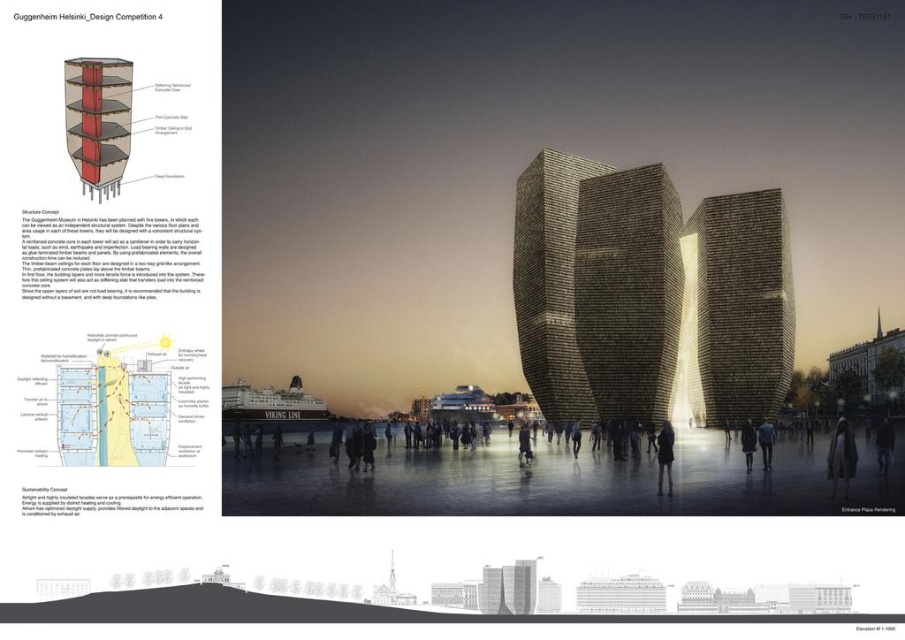
Question: In this image, where is rustic stone twin towers at center located relative to dark brown textured coat at center?

Choices:
 (A) left
 (B) right

Answer: (A)

Question: Which point is farther to the camera?

Choices:
 (A) (765, 461)
 (B) (654, 323)
 (C) (653, 392)

Answer: (A)

Question: Which object appears farthest from the camera in this image?

Choices:
 (A) dark brown leather jacket at center
 (B) dark brown textured coat at center
 (C) dark gray fabric coat at center
 (D) rustic stone tower at center

Answer: (B)

Question: Is the position of dark gray fabric coat at center less distant than that of dark brown textured coat at center?

Choices:
 (A) no
 (B) yes

Answer: (B)

Question: Does green textured stone tower at center have a lesser width compared to dark fabric jacket at center?

Choices:
 (A) yes
 (B) no

Answer: (A)

Question: Which object is the closest to the dark gray fabric coat at center?

Choices:
 (A) silhouette figure at center
 (B) rustic stone twin towers at center
 (C) rustic stone tower at center

Answer: (C)